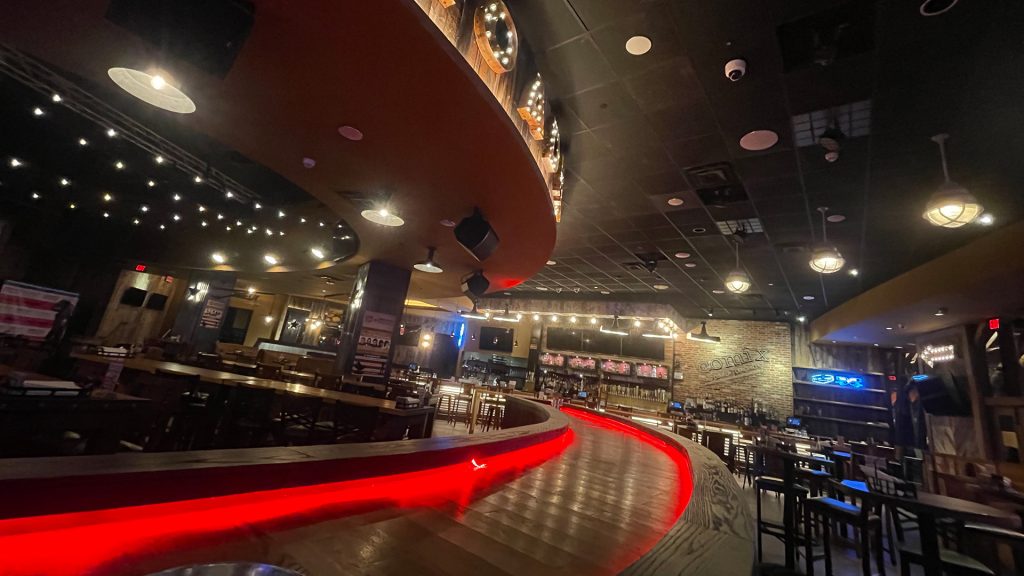
Where is `table`? The image size is (1024, 576). table is located at coordinates (355, 399).